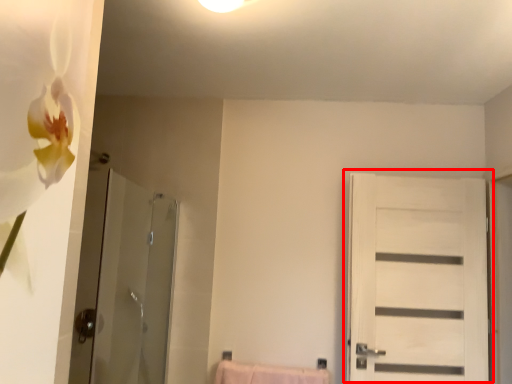
Question: In this image, where is door (annotated by the red box) located relative to screen door?

Choices:
 (A) right
 (B) left

Answer: (A)